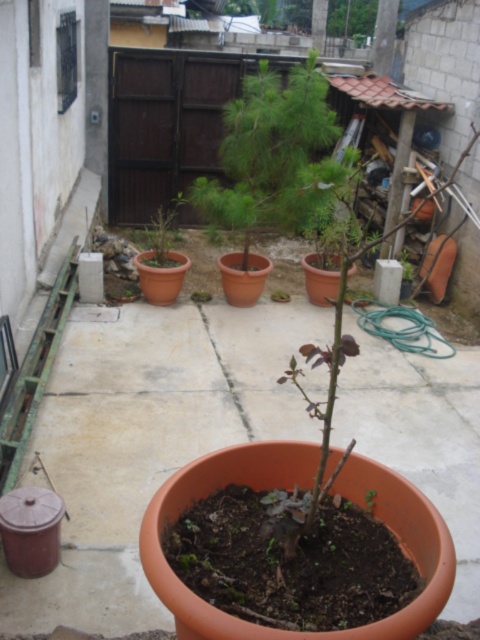
Question: Which object is positioned farthest from the green matte tree at center?

Choices:
 (A) matte brown pot at center
 (B) green matte plant at center

Answer: (B)

Question: Which object is the farthest from the matte brown pot at center?

Choices:
 (A) green matte plant at center
 (B) green matte tree at center

Answer: (A)

Question: Which of these objects is positioned closest to the matte brown pot at center?

Choices:
 (A) green matte plant at center
 (B) matte clay pot at center
 (C) green matte tree at center

Answer: (C)

Question: Does green matte tree at center appear over matte brown pot at center?

Choices:
 (A) yes
 (B) no

Answer: (A)

Question: Does green matte tree at center appear under green matte plant at center?

Choices:
 (A) yes
 (B) no

Answer: (B)

Question: Is matte brown pot at center smaller than green matte plant at center?

Choices:
 (A) no
 (B) yes

Answer: (A)